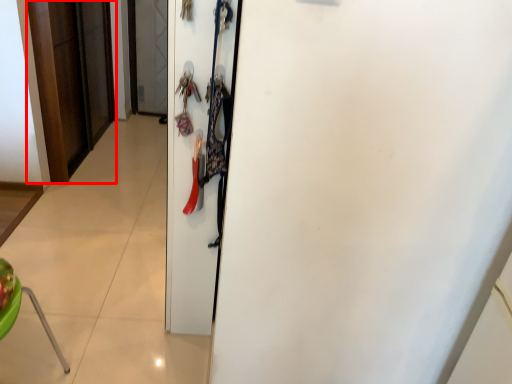
Question: Where is door (annotated by the red box) located in relation to door in the image?

Choices:
 (A) left
 (B) right

Answer: (A)